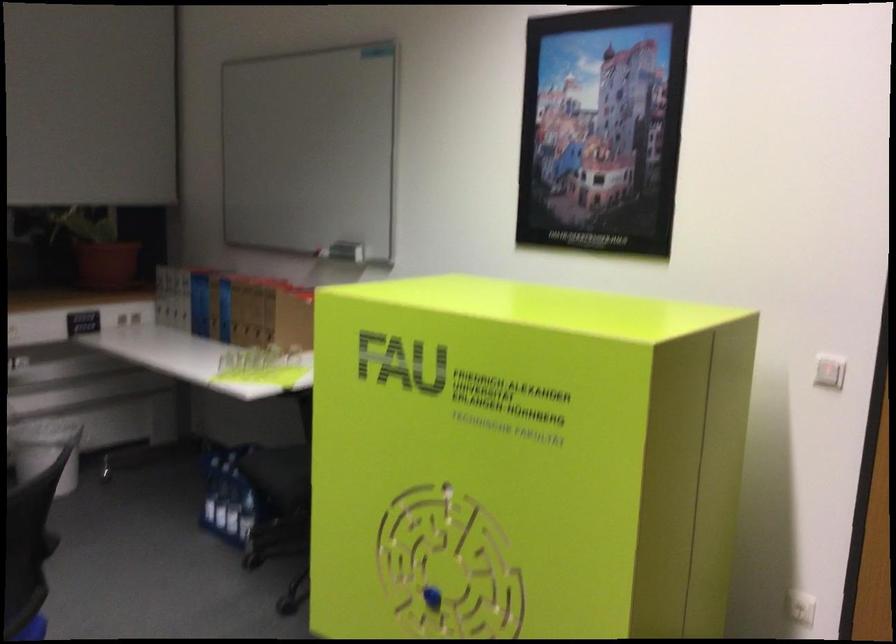
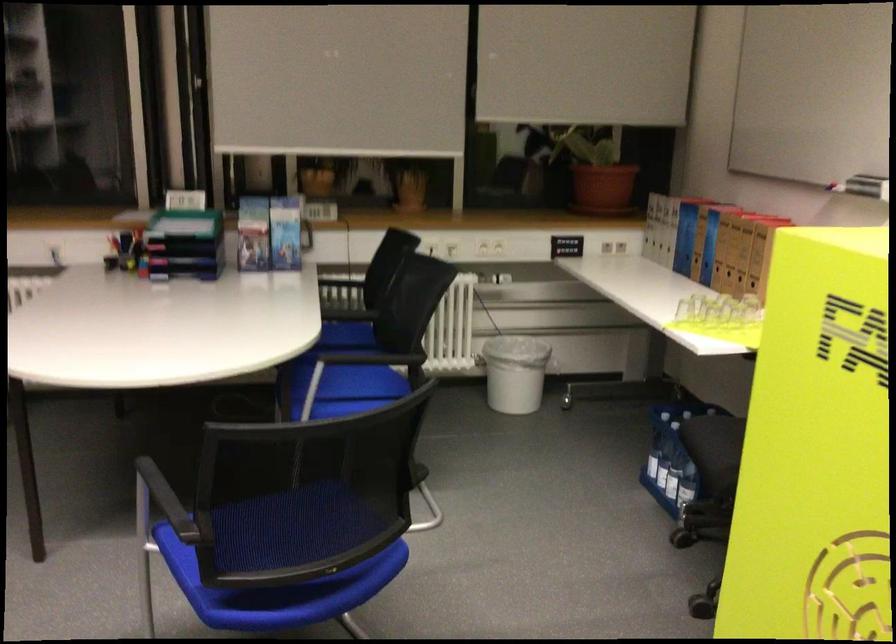
Find the pixel in the second image that matches (x=114, y=268) in the first image.

(602, 187)